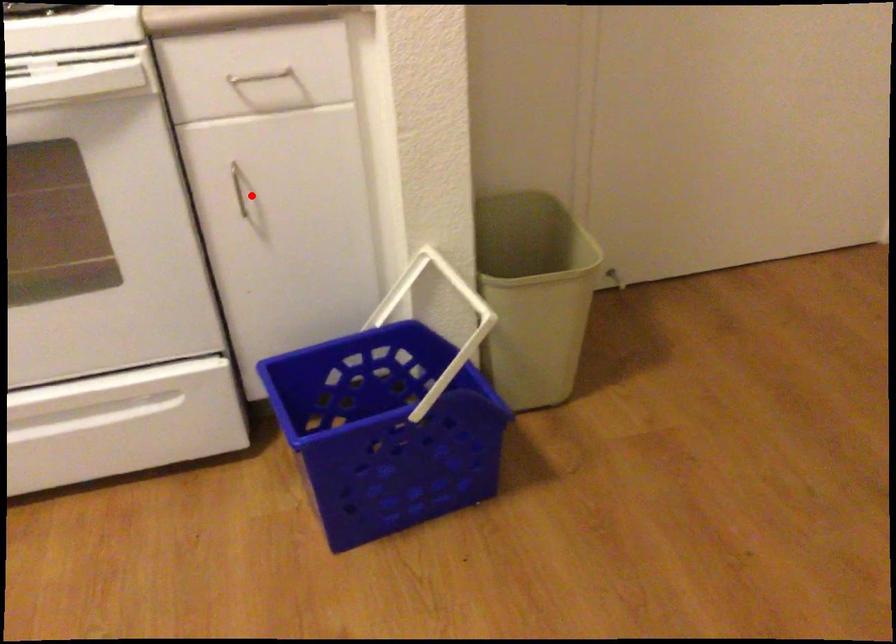
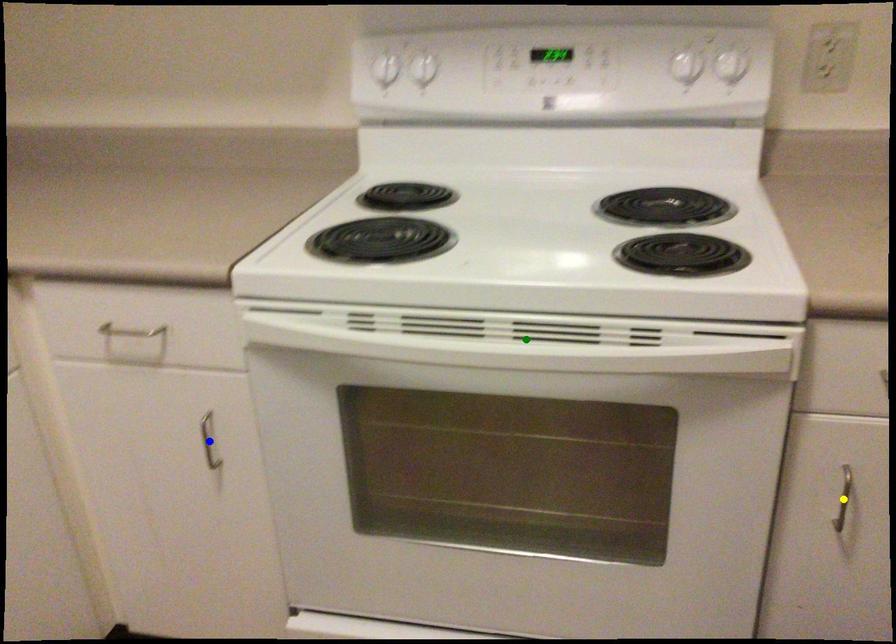
Question: I am providing you with two images of the same scene from different viewpoints. A red point is marked on the first image. You are given multiple points on the second image. Can you choose the point in image 2 that corresponds to the point in image 1?

Choices:
 (A) yellow point
 (B) blue point
 (C) green point

Answer: (A)